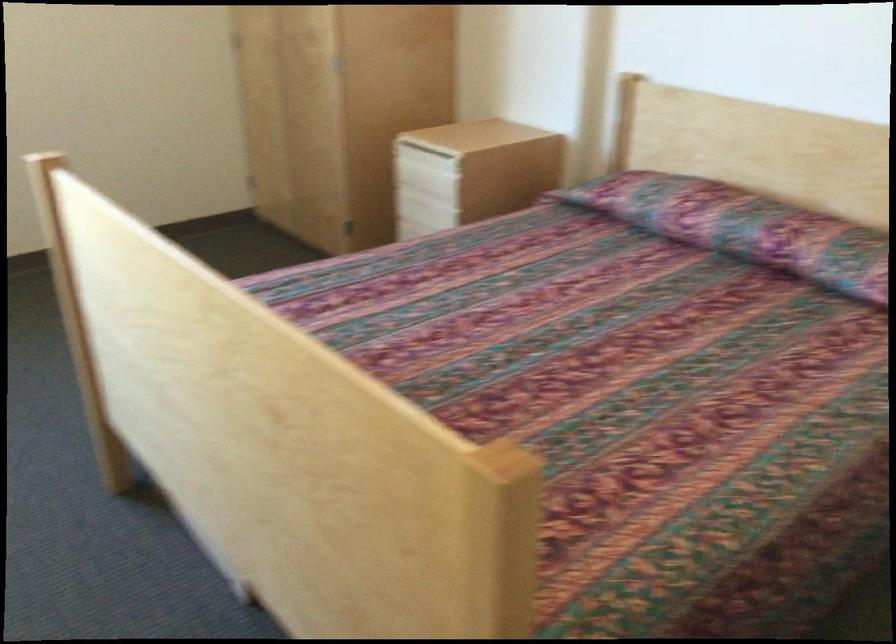
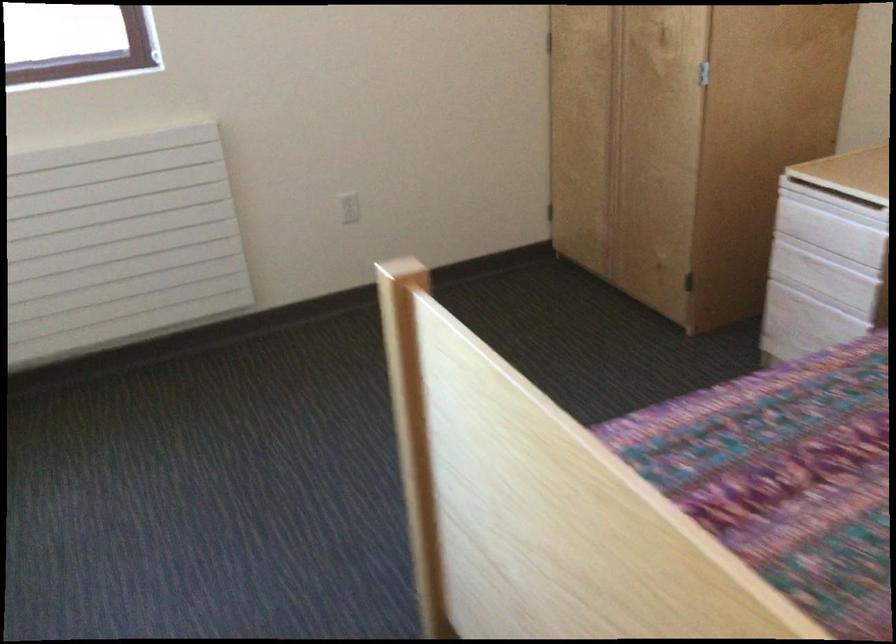
Which direction would the cameraman need to move to produce the second image?

The movement direction of the cameraman is left, forward.